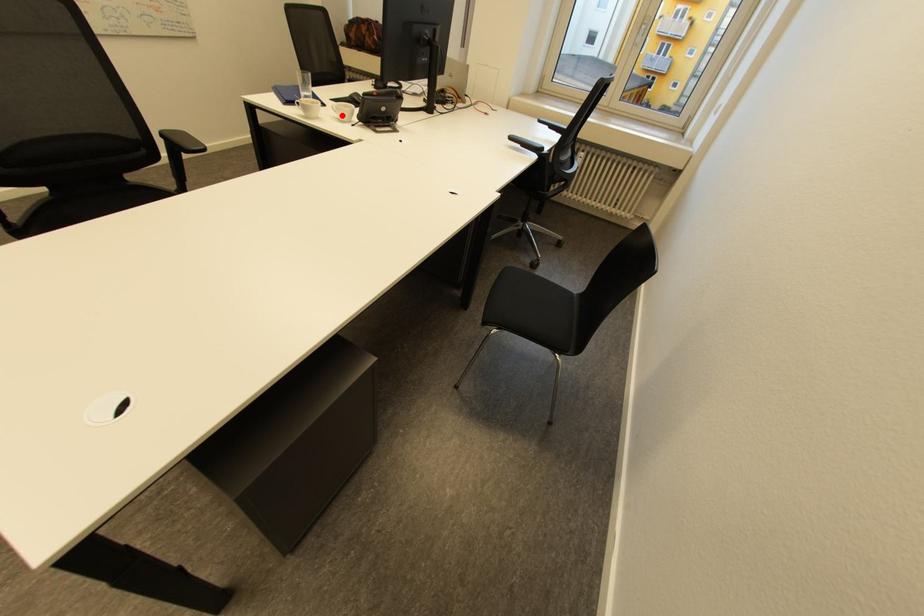
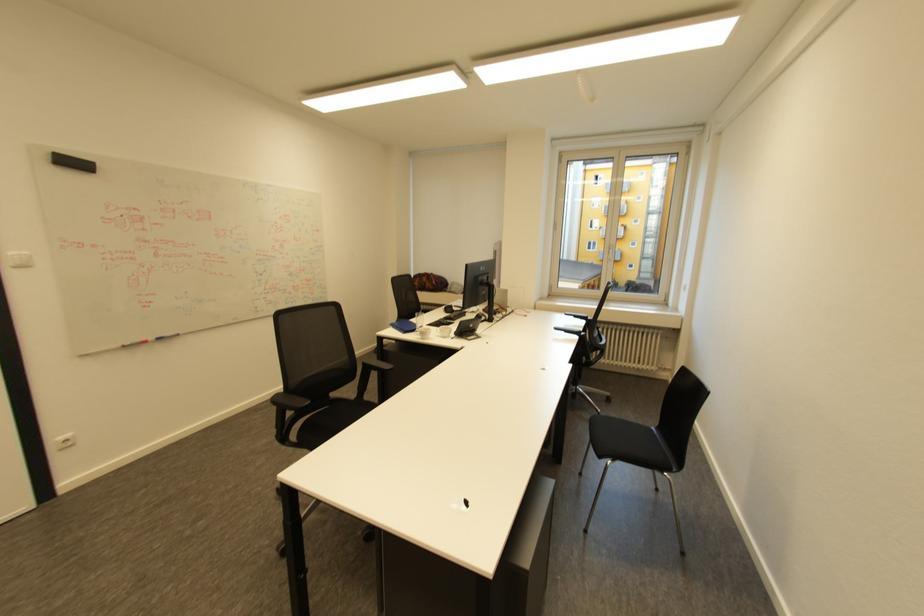
Where in the second image is the point corresponding to the highlighted location from the first image?

(446, 334)